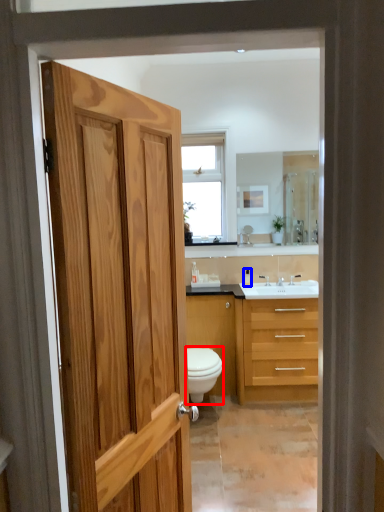
Question: Which of the following is the farthest to the observer, toilet (highlighted by a red box) or toiletry (highlighted by a blue box)?

Choices:
 (A) toilet
 (B) toiletry

Answer: (B)